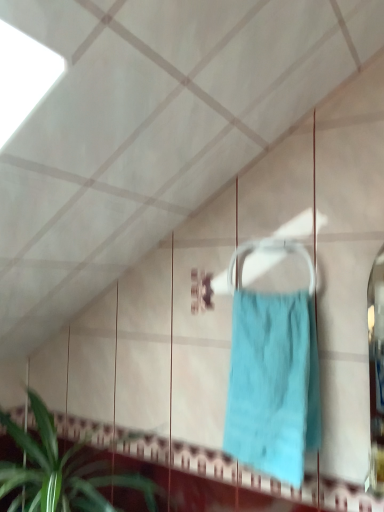
Measure the distance between teal fabric towel at center and camera.

teal fabric towel at center is 1.03 meters away from camera.

The width and height of the screenshot is (384, 512). What do you see at coordinates (273, 383) in the screenshot? I see `teal fabric towel at center` at bounding box center [273, 383].

At what (x,y) coordinates should I click in order to perform the action: click on teal fabric towel at center. Please return your answer as a coordinate pair (x, y). The width and height of the screenshot is (384, 512). Looking at the image, I should click on (273, 383).

You are a GUI agent. You are given a task and a screenshot of the screen. Output one action in this format:
    pyautogui.click(x=<x>, y=<y>)
    Task: Click on the green leafy plant at lower left
    
    Given the screenshot: What is the action you would take?
    pyautogui.click(x=60, y=471)

This screenshot has width=384, height=512. What do you see at coordinates (60, 471) in the screenshot?
I see `green leafy plant at lower left` at bounding box center [60, 471].

Measure the distance between point (54, 432) and camera.

Answer: 5.18 feet.

I want to click on teal fabric towel at center, so click(x=273, y=383).

Is green leafy plant at lower left to the right of teal fabric towel at center from the viewer's perspective?

No.

Is green leafy plant at lower left behind teal fabric towel at center?

No, green leafy plant at lower left is closer to the viewer.

Considering the points (155, 503) and (270, 461), which point is in front, point (155, 503) or point (270, 461)?

The point (270, 461) is closer.

In the scene shown: From the image's perspective, between green leafy plant at lower left and teal fabric towel at center, which one is located above?

From the image's view, teal fabric towel at center is above.

From a real-world perspective, is green leafy plant at lower left under teal fabric towel at center?

Yes.

Between green leafy plant at lower left and teal fabric towel at center, which one has smaller width?

Thinner between the two is teal fabric towel at center.

Does green leafy plant at lower left have a lesser height compared to teal fabric towel at center?

Yes, green leafy plant at lower left is shorter than teal fabric towel at center.

Considering the sizes of green leafy plant at lower left and teal fabric towel at center in the image, is green leafy plant at lower left bigger or smaller than teal fabric towel at center?

In the image, green leafy plant at lower left appears to be larger than teal fabric towel at center.

Can we say green leafy plant at lower left lies outside teal fabric towel at center?

Yes, green leafy plant at lower left is located beyond the bounds of teal fabric towel at center.

Is green leafy plant at lower left placed right next to teal fabric towel at center?

No, green leafy plant at lower left is not in contact with teal fabric towel at center.

Based on the photo, is green leafy plant at lower left oriented towards teal fabric towel at center?

No.

What's the angular difference between green leafy plant at lower left and teal fabric towel at center's facing directions?

The angle between the facing direction of green leafy plant at lower left and the facing direction of teal fabric towel at center is 0.0722 degrees.

Measure the distance from green leafy plant at lower left to teal fabric towel at center.

green leafy plant at lower left and teal fabric towel at center are 23.30 inches apart from each other.

At what (x,y) coordinates should I click in order to perform the action: click on houseplant in front of the teal fabric towel at center. Please return your answer as a coordinate pair (x, y). Looking at the image, I should click on (60, 471).

Does teal fabric towel at center appear on the right side of green leafy plant at lower left?

Yes.

Is teal fabric towel at center positioned in front of green leafy plant at lower left?

That is False.

In the scene shown: Which point is more forward, (258, 453) or (6, 469)?

Point (258, 453)

From the image's perspective, is teal fabric towel at center located beneath green leafy plant at lower left?

No, from the image's perspective, teal fabric towel at center is not beneath green leafy plant at lower left.

From a real-world perspective, does teal fabric towel at center stand above green leafy plant at lower left?

Yes, from a real-world perspective, teal fabric towel at center is over green leafy plant at lower left

Which of these two, teal fabric towel at center or green leafy plant at lower left, is thinner?

teal fabric towel at center is thinner.

Between teal fabric towel at center and green leafy plant at lower left, which one has less height?

green leafy plant at lower left is shorter.

Does teal fabric towel at center have a smaller size compared to green leafy plant at lower left?

Correct, teal fabric towel at center occupies less space than green leafy plant at lower left.

Is teal fabric towel at center positioned beyond the bounds of green leafy plant at lower left?

Yes, teal fabric towel at center is located beyond the bounds of green leafy plant at lower left.

Would you say teal fabric towel at center is a long distance from green leafy plant at lower left?

That's not correct — teal fabric towel at center is a little close to green leafy plant at lower left.

Is teal fabric towel at center positioned with its back to green leafy plant at lower left?

teal fabric towel at center does not have its back to green leafy plant at lower left.

Identify the location of houseplant lying below the teal fabric towel at center (from the image's perspective). Image resolution: width=384 pixels, height=512 pixels. (60, 471).

This screenshot has width=384, height=512. I want to click on towel that is behind the green leafy plant at lower left, so click(273, 383).

At what (x,y) coordinates should I click in order to perform the action: click on houseplant on the left of teal fabric towel at center. Please return your answer as a coordinate pair (x, y). This screenshot has height=512, width=384. Looking at the image, I should click on (60, 471).